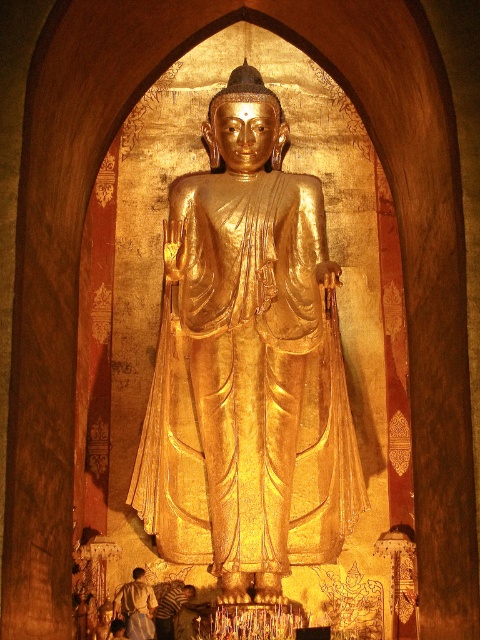
Question: Does gold polished statue at center appear on the right side of white cloth at lower left?

Choices:
 (A) no
 (B) yes

Answer: (B)

Question: Can you confirm if gold polished statue at center is wider than white cloth at lower left?

Choices:
 (A) no
 (B) yes

Answer: (B)

Question: Which object appears farthest from the camera in this image?

Choices:
 (A) white cloth at lower left
 (B) gold polished statue at center

Answer: (A)

Question: Considering the relative positions of gold polished statue at center and white cloth at lower left in the image provided, where is gold polished statue at center located with respect to white cloth at lower left?

Choices:
 (A) right
 (B) left

Answer: (A)